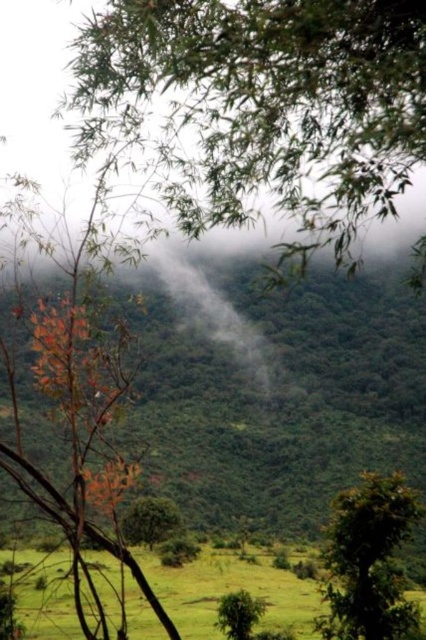
Who is more distant from viewer, (192,42) or (129,522)?

The point (129,522) is behind.

Between green leafy tree at upper center and green matte tree at center, which one is positioned higher?

Positioned higher is green leafy tree at upper center.

Does point (92, 44) come farther from viewer compared to point (169, 506)?

No, it is in front of (169, 506).

Find the location of a particular element. green leafy tree at upper center is located at coordinates (261, 106).

Which of these two, green leafy tree at upper center or green grassy field at lower center, stands taller?

Standing taller between the two is green leafy tree at upper center.

Is green leafy tree at upper center positioned behind green grassy field at lower center?

No.

Does point (259, 13) come behind point (198, 625)?

No.

This screenshot has width=426, height=640. In order to click on green leafy tree at upper center in this screenshot , I will do `click(261, 106)`.

Is green matte tree at lower right thinner than green matte tree at center?

Correct, green matte tree at lower right's width is less than green matte tree at center's.

Is point (351, 548) positioned in front of point (138, 538)?

Yes, point (351, 548) is closer to viewer.

The width and height of the screenshot is (426, 640). Identify the location of green matte tree at lower right. (368, 561).